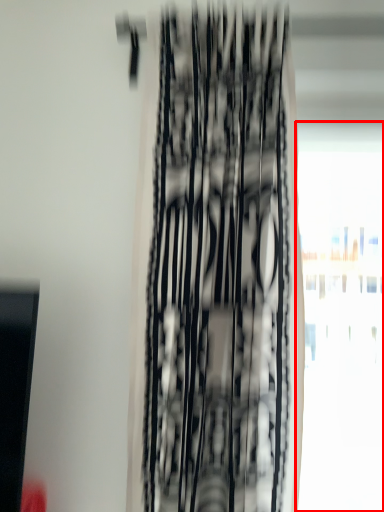
Question: From the image's perspective, what is the correct spatial positioning of window (annotated by the red box) in reference to curtain?

Choices:
 (A) below
 (B) above

Answer: (A)